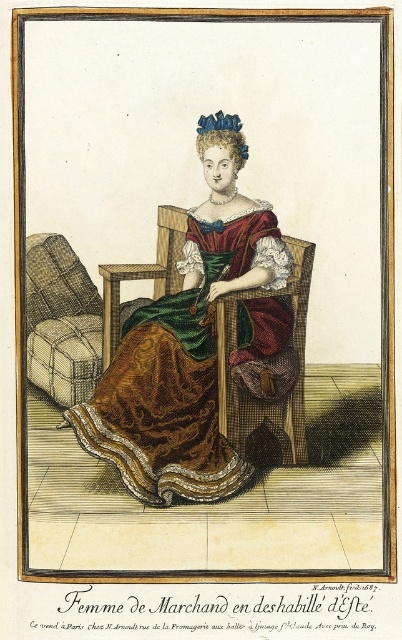
Consider the image. Is brown satin dress at center thinner than plaid fabric armchair at left?

In fact, brown satin dress at center might be wider than plaid fabric armchair at left.

Is brown satin dress at center to the right of plaid fabric armchair at left from the viewer's perspective?

Yes, brown satin dress at center is to the right of plaid fabric armchair at left.

Does point (205, 326) come behind point (30, 323)?

No, it is not.

At what (x,y) coordinates should I click in order to perform the action: click on brown satin dress at center. Please return your answer as a coordinate pair (x, y). Looking at the image, I should click on click(x=174, y=381).